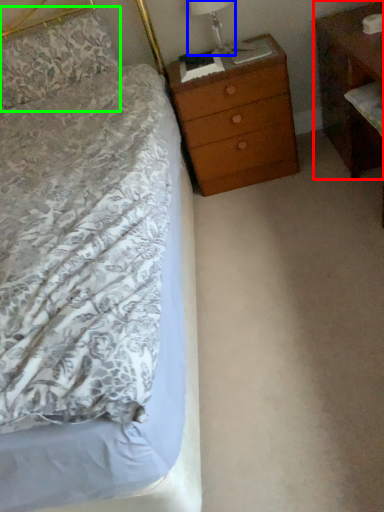
Question: Estimate the real-world distances between objects in this image. Which object is closer to nightstand (highlighted by a red box), bedside lamp (highlighted by a blue box) or pillow (highlighted by a green box)?

Choices:
 (A) bedside lamp
 (B) pillow

Answer: (A)